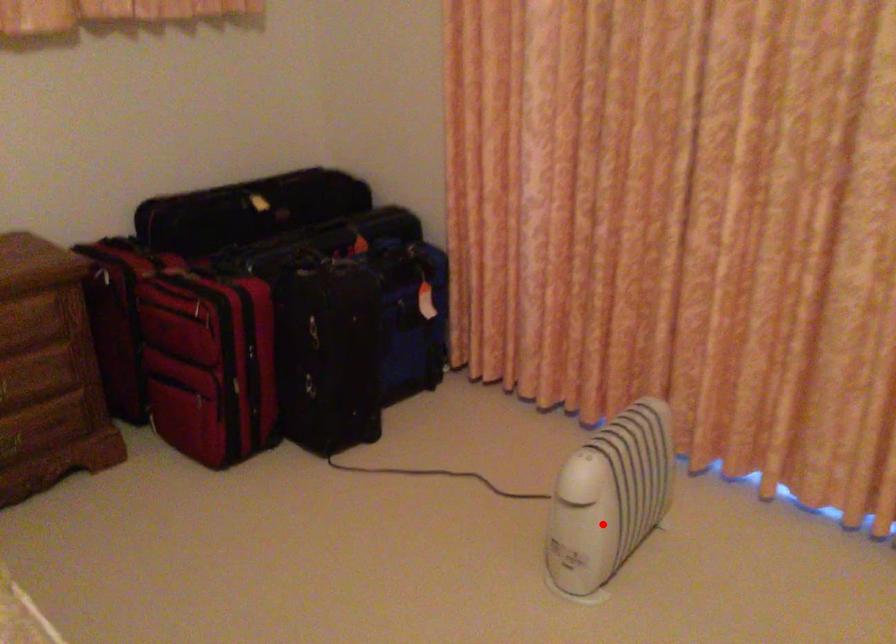
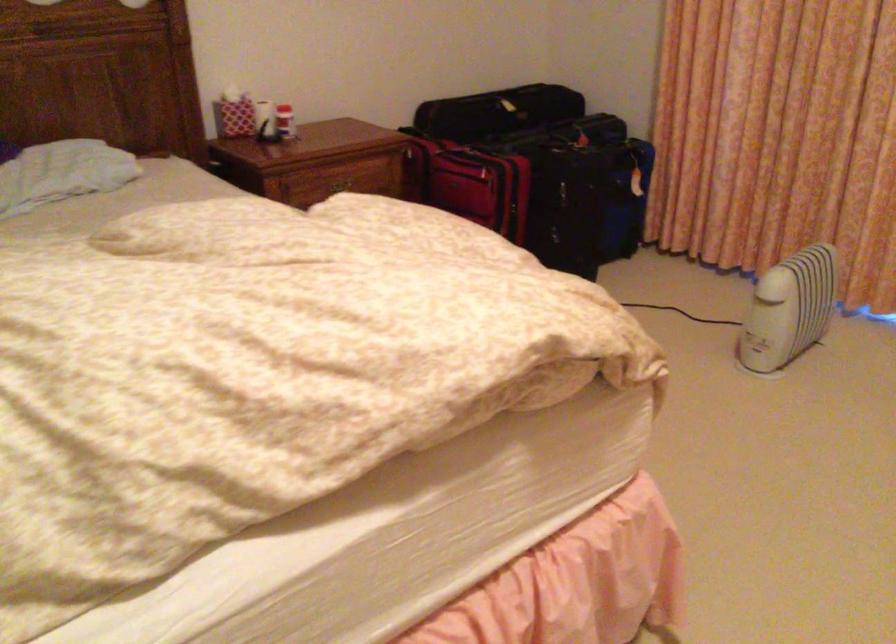
Question: I am providing you with two images of the same scene from different viewpoints. Image1 has a red point marked. In image2, the corresponding 3D location appears at what relative position? Reply with the corresponding letter.

Choices:
 (A) Closer
 (B) Farther

Answer: (B)